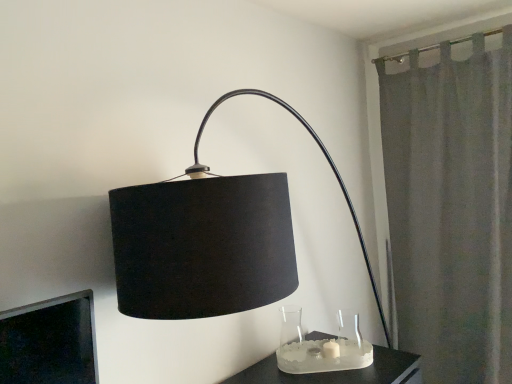
Question: From a real-world perspective, is clear glass vase at lower center, which is the second glass vase from right to left, positioned under gray fabric curtain at right based on gravity?

Choices:
 (A) yes
 (B) no

Answer: (A)

Question: Is clear glass vase at lower center, which is the second glass vase from right to left, thinner than gray fabric curtain at right?

Choices:
 (A) yes
 (B) no

Answer: (A)

Question: Can you confirm if clear glass vase at lower center, which is the second glass vase from right to left, is wider than gray fabric curtain at right?

Choices:
 (A) yes
 (B) no

Answer: (B)

Question: Can you confirm if clear glass vase at lower center, which is the second glass vase from right to left, is positioned to the right of gray fabric curtain at right?

Choices:
 (A) no
 (B) yes

Answer: (A)

Question: Is the position of clear glass vase at lower center, which is the second glass vase from right to left, more distant than that of gray fabric curtain at right?

Choices:
 (A) yes
 (B) no

Answer: (B)

Question: In the image, is clear glass vase at lower center, which is counted as the 1th glass vase, starting from the left, on the left side or the right side of satin glass candle holder at lower center?

Choices:
 (A) right
 (B) left

Answer: (B)

Question: From a real-world perspective, relative to satin glass candle holder at lower center, is clear glass vase at lower center, which is the second glass vase from right to left, vertically above or below?

Choices:
 (A) above
 (B) below

Answer: (A)

Question: Is clear glass vase at lower center, which is the second glass vase from right to left, wider or thinner than satin glass candle holder at lower center?

Choices:
 (A) wide
 (B) thin

Answer: (B)

Question: Looking at the image, does clear glass vase at lower center, which is counted as the 1th glass vase, starting from the left, seem bigger or smaller compared to satin glass candle holder at lower center?

Choices:
 (A) big
 (B) small

Answer: (B)

Question: Is point (450, 87) closer or farther from the camera than point (334, 342)?

Choices:
 (A) closer
 (B) farther

Answer: (B)

Question: Based on their positions, is gray fabric curtain at right located to the left or right of satin glass candle holder at lower center?

Choices:
 (A) right
 (B) left

Answer: (A)

Question: In the image, is gray fabric curtain at right positioned in front of or behind satin glass candle holder at lower center?

Choices:
 (A) behind
 (B) front

Answer: (A)

Question: From the image's perspective, is gray fabric curtain at right above or below satin glass candle holder at lower center?

Choices:
 (A) below
 (B) above

Answer: (B)

Question: Considering the positions of clear glass vase at lower center, which is counted as the 1th glass vase, starting from the left, and transparent glass vase at lower center, marked as the 1th glass vase in a right-to-left arrangement, in the image, is clear glass vase at lower center, which is counted as the 1th glass vase, starting from the left, bigger or smaller than transparent glass vase at lower center, marked as the 1th glass vase in a right-to-left arrangement,?

Choices:
 (A) small
 (B) big

Answer: (B)

Question: Considering the positions of clear glass vase at lower center, which is the second glass vase from right to left, and transparent glass vase at lower center, marked as the 1th glass vase in a right-to-left arrangement, in the image, is clear glass vase at lower center, which is the second glass vase from right to left, taller or shorter than transparent glass vase at lower center, marked as the 1th glass vase in a right-to-left arrangement,?

Choices:
 (A) tall
 (B) short

Answer: (A)